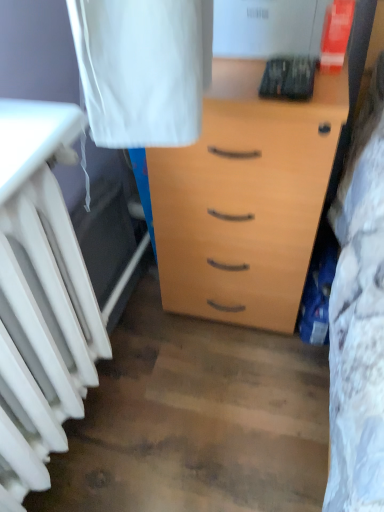
This screenshot has width=384, height=512. I want to click on vacant space in front of light wood chest of drawers at center, so click(221, 397).